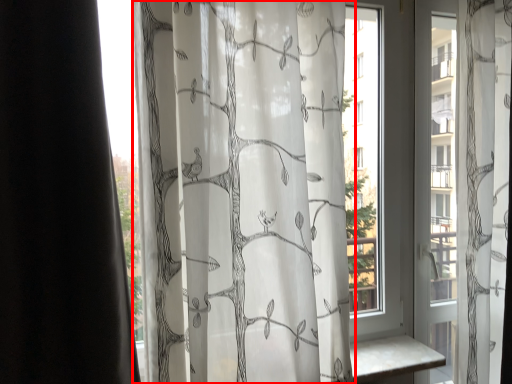
Question: From the image's perspective, where is curtain (annotated by the red box) located in relation to window in the image?

Choices:
 (A) below
 (B) above

Answer: (A)